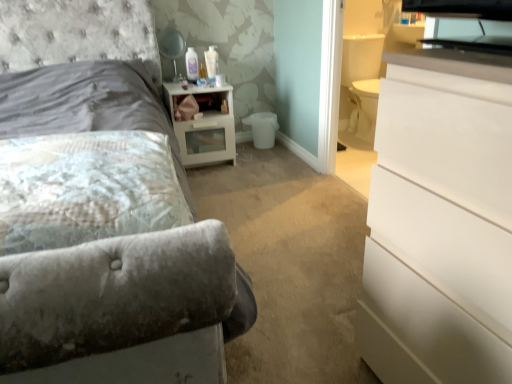
Find the location of `white glossy chest of drawers at right`. white glossy chest of drawers at right is located at coordinates (440, 222).

The image size is (512, 384). In order to click on matte black lampshade at upper center in this screenshot , I will do `click(172, 48)`.

The image size is (512, 384). What are the coordinates of `white glossy chest of drawers at right` in the screenshot? It's located at (440, 222).

From the image's perspective, is fluffy white pillow at left positioned above or below white glossy chest of drawers at right?

fluffy white pillow at left is above white glossy chest of drawers at right.

Considering the sizes of objects fluffy white pillow at left and white glossy chest of drawers at right in the image provided, who is smaller, fluffy white pillow at left or white glossy chest of drawers at right?

Smaller between the two is fluffy white pillow at left.

Would you say fluffy white pillow at left is to the left or to the right of white glossy chest of drawers at right in the picture?

Clearly, fluffy white pillow at left is on the left of white glossy chest of drawers at right in the image.

From a real-world perspective, who is located lower, matte black lampshade at upper center or fluffy white pillow at left?

In real-world perspective, fluffy white pillow at left is lower.

Is matte black lampshade at upper center smaller than fluffy white pillow at left?

Yes.

Is point (175, 62) more distant than point (165, 201)?

Yes, point (175, 62) is behind point (165, 201).

Is matte black lampshade at upper center positioned beyond the bounds of fluffy white pillow at left?

matte black lampshade at upper center is positioned outside fluffy white pillow at left.

How many degrees apart are the facing directions of white glossy nightstand at center and fluffy white pillow at left?

1.09 degrees separate the facing orientations of white glossy nightstand at center and fluffy white pillow at left.

Is white glossy nightstand at center shorter than fluffy white pillow at left?

No.

Does white glossy nightstand at center touch fluffy white pillow at left?

There is a gap between white glossy nightstand at center and fluffy white pillow at left.

Based on their positions, is white glossy nightstand at center located to the left or right of fluffy white pillow at left?

white glossy nightstand at center is to the right of fluffy white pillow at left.

Is the position of fluffy white pillow at left more distant than that of white glossy nightstand at center?

No, the depth of fluffy white pillow at left is less than that of white glossy nightstand at center.

Can you confirm if fluffy white pillow at left is smaller than white glossy nightstand at center?

Indeed, fluffy white pillow at left has a smaller size compared to white glossy nightstand at center.

From the image's perspective, between fluffy white pillow at left and white glossy nightstand at center, which one is located above?

From the image's view, white glossy nightstand at center is above.

Is white glossy nightstand at center at the back of fluffy white pillow at left?

That's not correct — fluffy white pillow at left is not looking away from white glossy nightstand at center.

Considering the sizes of velvet gray bed at upper left and fluffy white pillow at left in the image, is velvet gray bed at upper left taller or shorter than fluffy white pillow at left?

In the image, velvet gray bed at upper left appears to be taller than fluffy white pillow at left.

Considering the sizes of objects velvet gray bed at upper left and fluffy white pillow at left in the image provided, who is bigger, velvet gray bed at upper left or fluffy white pillow at left?

velvet gray bed at upper left.

Which of these two, velvet gray bed at upper left or fluffy white pillow at left, is wider?

With larger width is velvet gray bed at upper left.

In the scene shown: Does velvet gray bed at upper left touch fluffy white pillow at left?

velvet gray bed at upper left is not next to fluffy white pillow at left, and they're not touching.

Is white glossy chest of drawers at right a part of velvet gray bed at upper left?

No, white glossy chest of drawers at right is not inside velvet gray bed at upper left.

Is velvet gray bed at upper left to the right of white glossy chest of drawers at right from the viewer's perspective?

No, velvet gray bed at upper left is not to the right of white glossy chest of drawers at right.

Can you confirm if velvet gray bed at upper left is bigger than white glossy chest of drawers at right?

Correct, velvet gray bed at upper left is larger in size than white glossy chest of drawers at right.

In terms of size, does matte black lampshade at upper center appear bigger or smaller than white glossy nightstand at center?

matte black lampshade at upper center is smaller than white glossy nightstand at center.

Based on the photo, relative to white glossy nightstand at center, is matte black lampshade at upper center in front or behind?

matte black lampshade at upper center is positioned farther from the viewer than white glossy nightstand at center.

From a real-world perspective, which is physically above, matte black lampshade at upper center or white glossy nightstand at center?

In real-world perspective, matte black lampshade at upper center is above.

Could you tell me if matte black lampshade at upper center is facing white glossy nightstand at center?

No, matte black lampshade at upper center is not oriented towards white glossy nightstand at center.

The image size is (512, 384). In order to click on chest of drawers lying on the right of fluffy white pillow at left in this screenshot , I will do `click(440, 222)`.

The width and height of the screenshot is (512, 384). Identify the location of table lamp to the left of fluffy white pillow at left. (172, 48).

In the scene shown: When comparing their distances from velvet gray bed at upper left, does white glossy nightstand at center or matte black lampshade at upper center seem closer?

Based on the image, matte black lampshade at upper center appears to be nearer to velvet gray bed at upper left.

Which object lies nearer to the anchor point fluffy white pillow at left, matte black lampshade at upper center or white glossy chest of drawers at right?

The object closer to fluffy white pillow at left is white glossy chest of drawers at right.

From the image, which object appears to be nearer to white glossy chest of drawers at right, velvet gray bed at upper left or matte black lampshade at upper center?

velvet gray bed at upper left is positioned closer to the anchor white glossy chest of drawers at right.

Looking at the image, which one is located closer to fluffy white pillow at left, white glossy nightstand at center or white glossy chest of drawers at right?

The object closer to fluffy white pillow at left is white glossy chest of drawers at right.

From the image, which object appears to be farther from matte black lampshade at upper center, white glossy nightstand at center or velvet gray bed at upper left?

The object further to matte black lampshade at upper center is white glossy nightstand at center.

Which object lies further to the anchor point matte black lampshade at upper center, velvet gray bed at upper left or white glossy nightstand at center?

white glossy nightstand at center is positioned further to the anchor matte black lampshade at upper center.

From the picture: Based on their spatial positions, is velvet gray bed at upper left or fluffy white pillow at left further from white glossy nightstand at center?

fluffy white pillow at left.

Which object lies further to the anchor point velvet gray bed at upper left, matte black lampshade at upper center or fluffy white pillow at left?

fluffy white pillow at left lies further to velvet gray bed at upper left than the other object.

The height and width of the screenshot is (384, 512). What are the coordinates of `nightstand between fluffy white pillow at left and matte black lampshade at upper center along the z-axis` in the screenshot? It's located at (204, 124).

Where is `pillow positioned between white glossy chest of drawers at right and white glossy nightstand at center from near to far`? This screenshot has height=384, width=512. pillow positioned between white glossy chest of drawers at right and white glossy nightstand at center from near to far is located at coordinates (86, 188).

I want to click on pillow between velvet gray bed at upper left and white glossy nightstand at center along the z-axis, so click(x=86, y=188).

You are a GUI agent. You are given a task and a screenshot of the screen. Output one action in this format:
    pyautogui.click(x=<x>, y=<y>)
    Task: Click on the chest of drawers between velvet gray bed at upper left and matte black lampshade at upper center in the front-back direction
    This screenshot has width=512, height=384.
    Given the screenshot: What is the action you would take?
    pyautogui.click(x=440, y=222)